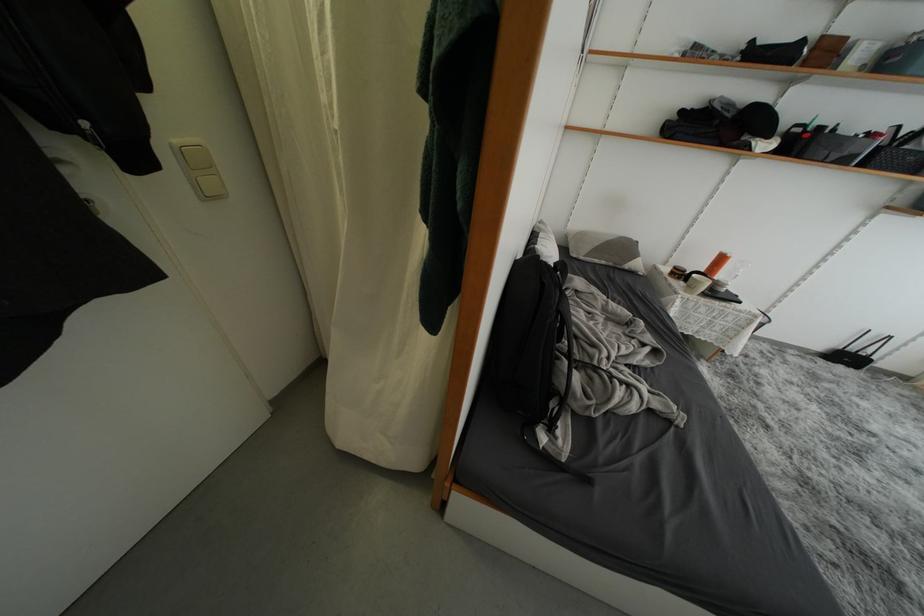
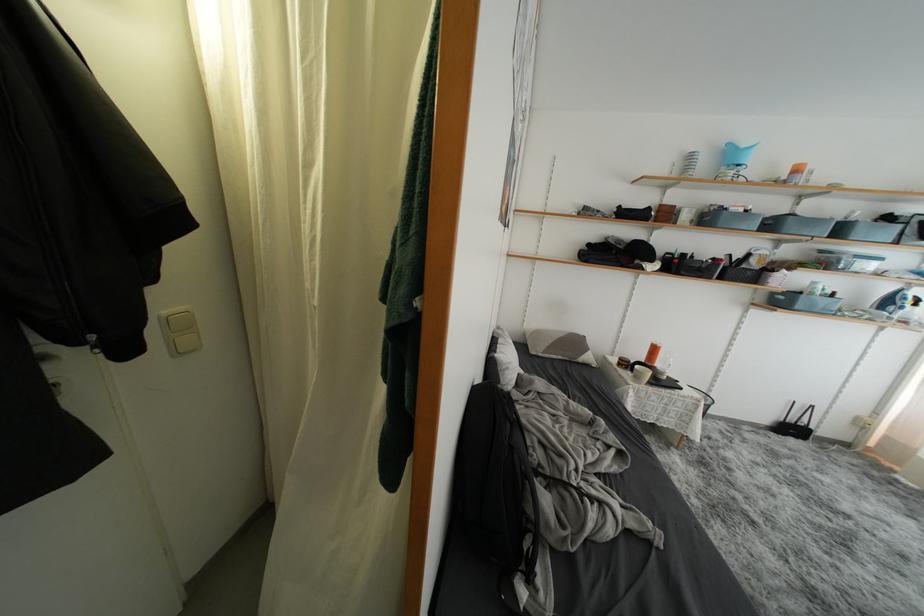
In a continuous first-person perspective shot, in which direction is the camera moving?

The cameraman walked toward right, backward.